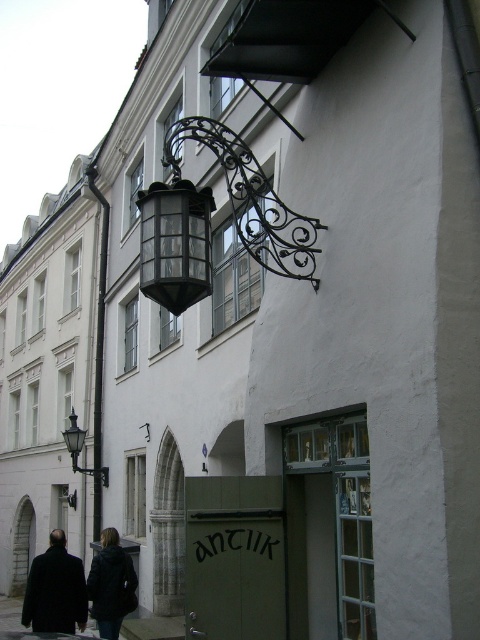
Question: Considering the relative positions of dark wool coat at lower left and dark gray jacket at lower left in the image provided, where is dark wool coat at lower left located with respect to dark gray jacket at lower left?

Choices:
 (A) above
 (B) below

Answer: (B)

Question: Which of the following is the farthest from the observer?

Choices:
 (A) gray concrete pavement at lower center
 (B) matte black lantern at upper center
 (C) matte black lantern at left

Answer: (C)

Question: Which is nearer to the matte black lantern at left?

Choices:
 (A) dark gray jacket at lower left
 (B) dark wool coat at lower left
 (C) matte black lantern at upper center

Answer: (B)

Question: In this image, where is matte black lantern at upper center located relative to gray concrete pavement at lower center?

Choices:
 (A) above
 (B) below

Answer: (A)

Question: Among these objects, which one is nearest to the camera?

Choices:
 (A) dark gray jacket at lower left
 (B) dark wool coat at lower left

Answer: (B)

Question: Observing the image, what is the correct spatial positioning of matte black lantern at upper center in reference to dark wool coat at lower left?

Choices:
 (A) above
 (B) below

Answer: (A)